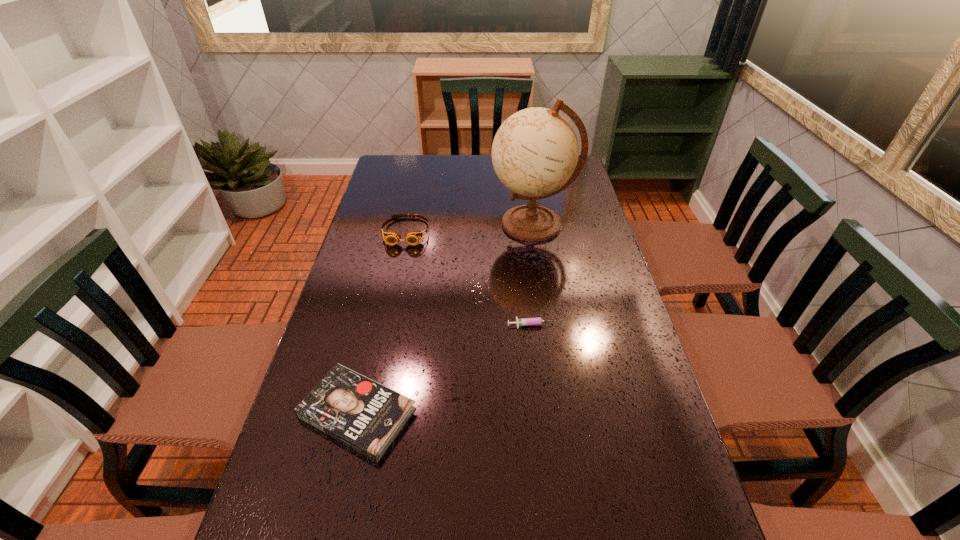
You are a GUI agent. You are given a task and a screenshot of the screen. Output one action in this format:
    pyautogui.click(x=<x>, y=<y>)
    Task: Click on the vacant space that satisfies the following two spatial constraints: 1. on the back side of the second nearest object; 2. on the left side of the book
    The width and height of the screenshot is (960, 540).
    Given the screenshot: What is the action you would take?
    pyautogui.click(x=377, y=326)

I want to click on free spot that satisfies the following two spatial constraints: 1. on the surface of the globe; 2. on the front side of the third tallest object, so click(x=562, y=413).

The height and width of the screenshot is (540, 960). I want to click on vacant space that satisfies the following two spatial constraints: 1. on the back side of the shortest object; 2. on the left side of the book, so click(377, 326).